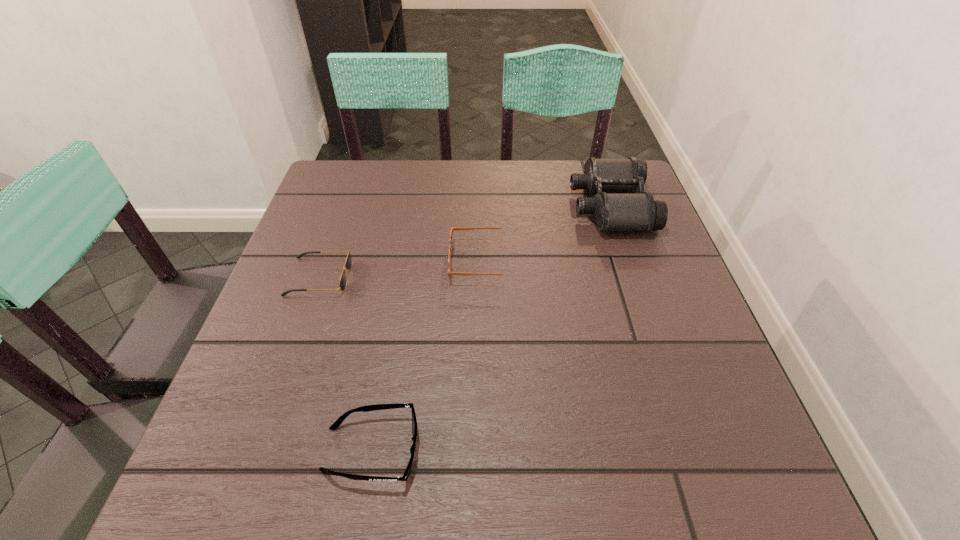
Locate an element on the screen. vacant area situated on the front-facing side of the tallest sunglasses is located at coordinates coord(415,261).

I want to click on free spot located 0.060m on the front-facing side of the tallest sunglasses, so click(x=423, y=261).

The image size is (960, 540). In order to click on vacant space located 0.220m on the front-facing side of the tallest sunglasses in this screenshot , I will do `click(353, 261)`.

The width and height of the screenshot is (960, 540). Identify the location of free space located on the front-facing side of the leftmost object. (514, 277).

The image size is (960, 540). I want to click on vacant space located on the front-facing side of the second object from left to right, so click(x=538, y=449).

Locate an element on the screen. The image size is (960, 540). object present at the far edge is located at coordinates (616, 207).

Where is `object that is positioned at the near edge`? The image size is (960, 540). object that is positioned at the near edge is located at coordinates (337, 423).

Find the location of `object that is at the left edge`. object that is at the left edge is located at coordinates (348, 263).

I want to click on object present at the right edge, so click(x=616, y=207).

Locate an element on the screen. The height and width of the screenshot is (540, 960). object located at the far right corner is located at coordinates (616, 207).